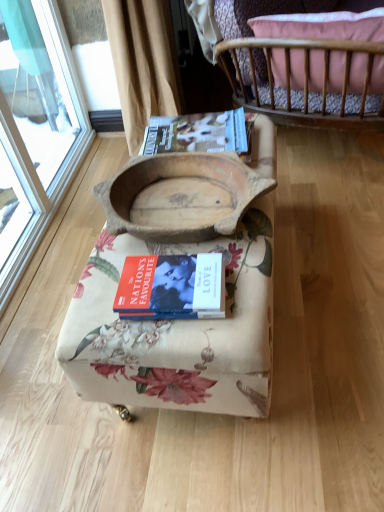
Locate an element on the screen. free area behind hardcover book at center is located at coordinates (151, 241).